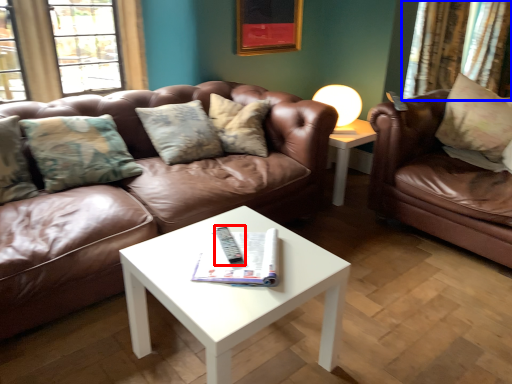
Question: Which object appears closest to the camera in this image, remote (highlighted by a red box) or curtain (highlighted by a blue box)?

Choices:
 (A) remote
 (B) curtain

Answer: (A)